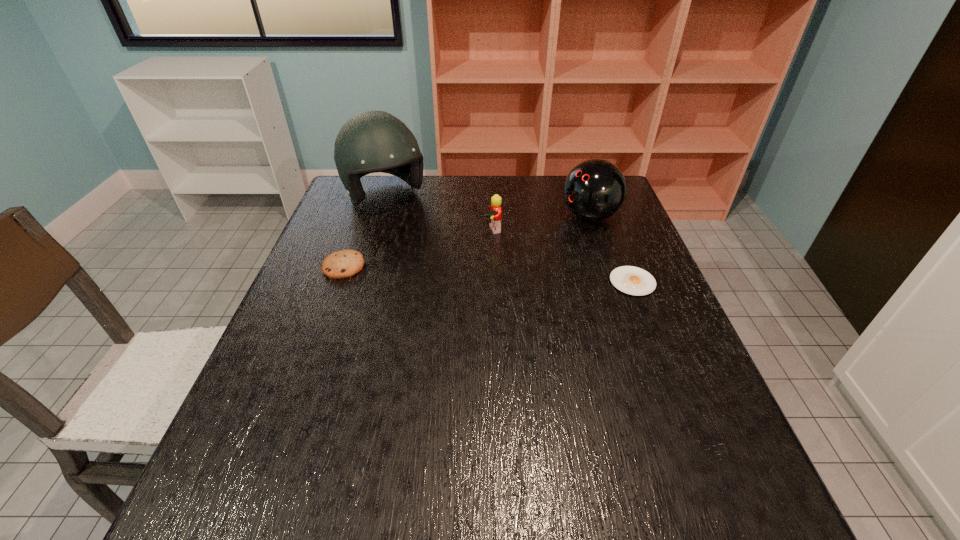
Locate an element on the screen. The width and height of the screenshot is (960, 540). vacant spot on the desktop that is between the fourth tallest object and the egg yolk and is positioned at the face opening of the tallest object is located at coordinates (445, 272).

The height and width of the screenshot is (540, 960). I want to click on vacant space on the desktop that is between the second shortest object and the shortest object and is positioned in front of the third shortest object with the accessory visible, so click(514, 275).

Locate an element on the screen. vacant space on the desktop that is between the cookie and the shortest object and is positioned on the surface of the bowling ball near the finger holes is located at coordinates (446, 272).